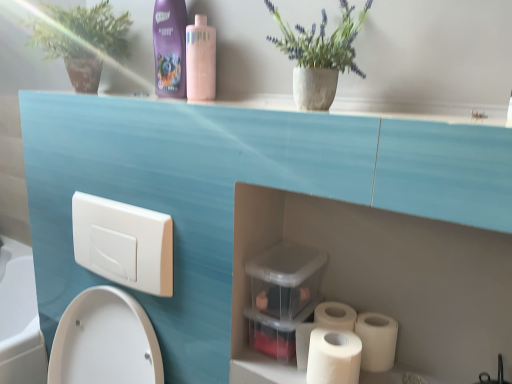
In order to face white matte toilet paper at lower right, which appears as the 1th toilet paper when viewed from the right, should I rotate leftwards or rightwards?

To face it directly, rotate right by 15.394 degrees.

This screenshot has height=384, width=512. What do you see at coordinates (170, 48) in the screenshot? I see `purple glossy shampoo at upper center, the 1th cleaning product positioned from the left` at bounding box center [170, 48].

What is the approximate width of green matte plant at upper left?

8.95 inches.

Based on the photo, measure the distance between green matte plant at upper left and camera.

They are 3.52 feet apart.

Where is `pink matte bottle at upper center, arranged as the 1th cleaning product when viewed from the right`? The width and height of the screenshot is (512, 384). pink matte bottle at upper center, arranged as the 1th cleaning product when viewed from the right is located at coordinates (201, 60).

Locate an element on the screen. The height and width of the screenshot is (384, 512). white matte toilet paper at lower right, marked as the second toilet paper in a left-to-right arrangement is located at coordinates (377, 341).

From the picture: Considering the relative positions of white matte toilet paper at lower right, the first toilet paper when ordered from left to right, and pink matte bottle at upper center, which is the second cleaning product from left to right, in the image provided, is white matte toilet paper at lower right, the first toilet paper when ordered from left to right, to the left of pink matte bottle at upper center, which is the second cleaning product from left to right, from the viewer's perspective?

No, white matte toilet paper at lower right, the first toilet paper when ordered from left to right, is not to the left of pink matte bottle at upper center, which is the second cleaning product from left to right.

Which object is wider, white matte toilet paper at lower right, the first toilet paper when ordered from left to right, or pink matte bottle at upper center, arranged as the 1th cleaning product when viewed from the right?

Wider between the two is white matte toilet paper at lower right, the first toilet paper when ordered from left to right.

How many degrees apart are the facing directions of white matte toilet paper at lower right, the first toilet paper when ordered from left to right, and pink matte bottle at upper center, which is the second cleaning product from left to right?

The facing directions of white matte toilet paper at lower right, the first toilet paper when ordered from left to right, and pink matte bottle at upper center, which is the second cleaning product from left to right, are 0.266 degrees apart.

Does white matte toilet paper at lower right, the second toilet paper positioned from the right, turn towards pink matte bottle at upper center, arranged as the 1th cleaning product when viewed from the right?

No, white matte toilet paper at lower right, the second toilet paper positioned from the right, does not turn towards pink matte bottle at upper center, arranged as the 1th cleaning product when viewed from the right.

From a real-world perspective, which object stands above the other?

In real-world perspective, purple glossy shampoo at upper center, which is the second cleaning product from right to left, is above.

From the picture: Are matte concrete pot at upper center and purple glossy shampoo at upper center, the 1th cleaning product positioned from the left, far apart?

Actually, matte concrete pot at upper center and purple glossy shampoo at upper center, the 1th cleaning product positioned from the left, are a little close together.

Between matte concrete pot at upper center and purple glossy shampoo at upper center, which is the second cleaning product from right to left, which one is positioned behind?

purple glossy shampoo at upper center, which is the second cleaning product from right to left.

From the image's perspective, is matte concrete pot at upper center located above purple glossy shampoo at upper center, which is the second cleaning product from right to left?

No, from the image's perspective, matte concrete pot at upper center is not above purple glossy shampoo at upper center, which is the second cleaning product from right to left.

From a real-world perspective, is white matte toilet paper at lower right, marked as the second toilet paper in a left-to-right arrangement, positioned over matte concrete pot at upper center based on gravity?

No, from a real-world perspective, white matte toilet paper at lower right, marked as the second toilet paper in a left-to-right arrangement, is not above matte concrete pot at upper center.

Is white matte toilet paper at lower right, which appears as the 1th toilet paper when viewed from the right, wider than matte concrete pot at upper center?

In fact, white matte toilet paper at lower right, which appears as the 1th toilet paper when viewed from the right, might be narrower than matte concrete pot at upper center.

Based on the photo, is white matte toilet paper at lower right, marked as the second toilet paper in a left-to-right arrangement, taller than matte concrete pot at upper center?

No, white matte toilet paper at lower right, marked as the second toilet paper in a left-to-right arrangement, is not taller than matte concrete pot at upper center.

Can you tell me how much purple glossy shampoo at upper center, which is the second cleaning product from right to left, and white matte toilet paper at lower right, which appears as the 1th toilet paper when viewed from the right, differ in facing direction?

0.266 degrees separate the facing orientations of purple glossy shampoo at upper center, which is the second cleaning product from right to left, and white matte toilet paper at lower right, which appears as the 1th toilet paper when viewed from the right.

From a real-world perspective, count 2nd toilet papers downward from the purple glossy shampoo at upper center, the 1th cleaning product positioned from the left, and point to it. Please provide its 2D coordinates.

[(377, 341)]

Is point (164, 34) closer to viewer compared to point (380, 332)?

No, it is not.

Is white matte toilet paper at lower right, marked as the second toilet paper in a left-to-right arrangement, surrounded by purple glossy shampoo at upper center, the 1th cleaning product positioned from the left?

That's incorrect, white matte toilet paper at lower right, marked as the second toilet paper in a left-to-right arrangement, is not inside purple glossy shampoo at upper center, the 1th cleaning product positioned from the left.

From their relative heights in the image, would you say matte concrete pot at upper center is taller or shorter than white matte toilet paper at lower right, the first toilet paper when ordered from left to right?

Clearly, matte concrete pot at upper center is taller compared to white matte toilet paper at lower right, the first toilet paper when ordered from left to right.

Does matte concrete pot at upper center have a larger size compared to white matte toilet paper at lower right, the second toilet paper positioned from the right?

Yes.

Is white matte toilet paper at lower right, the second toilet paper positioned from the right, completely or partially inside matte concrete pot at upper center?

No.

From the image's perspective, which one is positioned lower, pink matte bottle at upper center, which is the second cleaning product from left to right, or matte concrete pot at upper center?

matte concrete pot at upper center appears lower in the image.

Looking at the image, does pink matte bottle at upper center, arranged as the 1th cleaning product when viewed from the right, seem bigger or smaller compared to matte concrete pot at upper center?

In the image, pink matte bottle at upper center, arranged as the 1th cleaning product when viewed from the right, appears to be smaller than matte concrete pot at upper center.

Find the location of `flower that appears on the right of pink matte bottle at upper center, arranged as the 1th cleaning product when viewed from the right`. flower that appears on the right of pink matte bottle at upper center, arranged as the 1th cleaning product when viewed from the right is located at coordinates (322, 41).

Is pink matte bottle at upper center, arranged as the 1th cleaning product when viewed from the right, touching matte concrete pot at upper center?

No.

From a real-world perspective, is pink matte bottle at upper center, which is the second cleaning product from left to right, above or below green matte plant at upper left?

Clearly, from a real-world perspective, pink matte bottle at upper center, which is the second cleaning product from left to right, is below green matte plant at upper left.

Considering the relative sizes of pink matte bottle at upper center, arranged as the 1th cleaning product when viewed from the right, and green matte plant at upper left in the image provided, is pink matte bottle at upper center, arranged as the 1th cleaning product when viewed from the right, wider than green matte plant at upper left?

No.

From the image's perspective, starting from the green matte plant at upper left, which cleaning product is the 2nd one below? Please provide its 2D coordinates.

[(201, 60)]

You are a GUI agent. You are given a task and a screenshot of the screen. Output one action in this format:
    pyautogui.click(x=<x>, y=<y>)
    Task: Click on the toilet paper that is the 1st one below the pink matte bottle at upper center, arranged as the 1th cleaning product when viewed from the right (from a real-world perspective)
    This screenshot has width=512, height=384.
    Given the screenshot: What is the action you would take?
    pyautogui.click(x=333, y=357)

From the image's perspective, count 2nd cleaning products upward from the matte concrete pot at upper center and point to it. Please provide its 2D coordinates.

[(170, 48)]

When comparing their distances from pink matte bottle at upper center, which is the second cleaning product from left to right, does matte concrete pot at upper center or purple glossy shampoo at upper center, which is the second cleaning product from right to left, seem closer?

purple glossy shampoo at upper center, which is the second cleaning product from right to left.

From the picture: From the image, which object appears to be nearer to purple glossy shampoo at upper center, the 1th cleaning product positioned from the left, pink matte bottle at upper center, arranged as the 1th cleaning product when viewed from the right, or white matte toilet paper at lower right, marked as the second toilet paper in a left-to-right arrangement?

Among the two, pink matte bottle at upper center, arranged as the 1th cleaning product when viewed from the right, is located nearer to purple glossy shampoo at upper center, the 1th cleaning product positioned from the left.

From the image, which object appears to be farther from purple glossy shampoo at upper center, the 1th cleaning product positioned from the left, matte concrete pot at upper center or white matte toilet paper at lower right, the first toilet paper when ordered from left to right?

white matte toilet paper at lower right, the first toilet paper when ordered from left to right, is further to purple glossy shampoo at upper center, the 1th cleaning product positioned from the left.

When comparing their distances from white matte toilet paper at lower right, marked as the second toilet paper in a left-to-right arrangement, does purple glossy shampoo at upper center, which is the second cleaning product from right to left, or white matte toilet paper at lower right, the second toilet paper positioned from the right, seem further?

purple glossy shampoo at upper center, which is the second cleaning product from right to left, lies further to white matte toilet paper at lower right, marked as the second toilet paper in a left-to-right arrangement, than the other object.

Considering their positions, is purple glossy shampoo at upper center, the 1th cleaning product positioned from the left, positioned further to green matte plant at upper left than matte concrete pot at upper center?

Based on the image, matte concrete pot at upper center appears to be further to green matte plant at upper left.

Looking at this image, estimate the real-world distances between objects in this image. Which object is closer to white matte toilet paper at lower right, which appears as the 1th toilet paper when viewed from the right, green matte plant at upper left or purple glossy shampoo at upper center, which is the second cleaning product from right to left?

Among the two, purple glossy shampoo at upper center, which is the second cleaning product from right to left, is located nearer to white matte toilet paper at lower right, which appears as the 1th toilet paper when viewed from the right.

Looking at the image, which one is located further to white matte toilet paper at lower right, the first toilet paper when ordered from left to right, pink matte bottle at upper center, which is the second cleaning product from left to right, or purple glossy shampoo at upper center, which is the second cleaning product from right to left?

purple glossy shampoo at upper center, which is the second cleaning product from right to left, lies further to white matte toilet paper at lower right, the first toilet paper when ordered from left to right, than the other object.

Based on their spatial positions, is purple glossy shampoo at upper center, which is the second cleaning product from right to left, or matte concrete pot at upper center further from white matte toilet paper at lower right, the first toilet paper when ordered from left to right?

The object further to white matte toilet paper at lower right, the first toilet paper when ordered from left to right, is purple glossy shampoo at upper center, which is the second cleaning product from right to left.

At what (x,y) coordinates should I click in order to perform the action: click on toilet paper between pink matte bottle at upper center, arranged as the 1th cleaning product when viewed from the right, and white matte toilet paper at lower right, the second toilet paper positioned from the right, in the vertical direction. Please return your answer as a coordinate pair (x, y). Image resolution: width=512 pixels, height=384 pixels. Looking at the image, I should click on (377, 341).

At what (x,y) coordinates should I click in order to perform the action: click on flower between purple glossy shampoo at upper center, which is the second cleaning product from right to left, and white matte toilet paper at lower right, the first toilet paper when ordered from left to right, in the vertical direction. Please return your answer as a coordinate pair (x, y). Image resolution: width=512 pixels, height=384 pixels. Looking at the image, I should click on (322, 41).

The width and height of the screenshot is (512, 384). I want to click on flower between purple glossy shampoo at upper center, the 1th cleaning product positioned from the left, and white matte toilet paper at lower right, which appears as the 1th toilet paper when viewed from the right, vertically, so click(x=322, y=41).

Locate an element on the screen. This screenshot has height=384, width=512. flower situated between green matte plant at upper left and white matte toilet paper at lower right, marked as the second toilet paper in a left-to-right arrangement, from left to right is located at coordinates (322, 41).